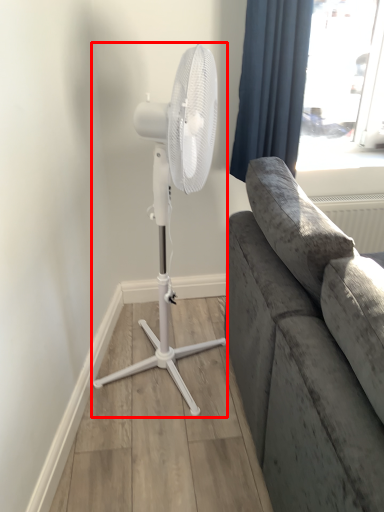
Question: Observing the image, what is the correct spatial positioning of mechanical fan (annotated by the red box) in reference to curtain?

Choices:
 (A) left
 (B) right

Answer: (A)